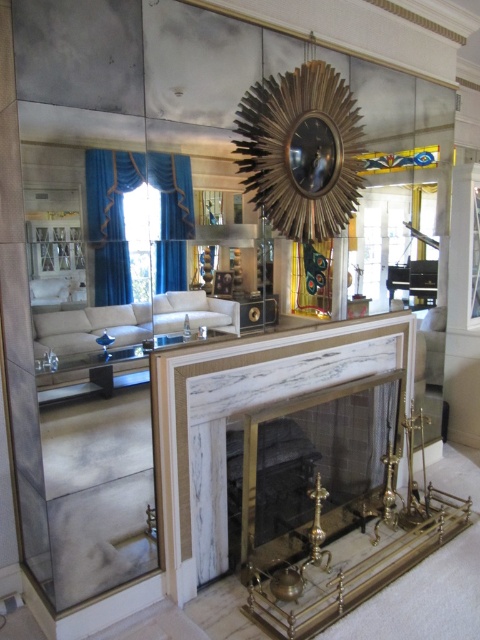
Question: Can you confirm if gold/marble fireplace at center is bigger than gold metallic clock at upper center?

Choices:
 (A) yes
 (B) no

Answer: (A)

Question: Is gold/marble fireplace at center to the right of white marble fireplace at center from the viewer's perspective?

Choices:
 (A) yes
 (B) no

Answer: (A)

Question: Among these objects, which one is farthest from the camera?

Choices:
 (A) white marble fireplace at center
 (B) gold metallic clock at upper center
 (C) gold/marble fireplace at center
 (D) gold textured sunburst clock at center

Answer: (B)

Question: Can you confirm if gold textured sunburst clock at center is positioned above gold metallic clock at upper center?

Choices:
 (A) yes
 (B) no

Answer: (A)

Question: Which object is the closest to the gold textured sunburst clock at center?

Choices:
 (A) gold metallic clock at upper center
 (B) gold/marble fireplace at center
 (C) white leather sofa at center
 (D) white marble fireplace at center

Answer: (A)

Question: Which point appears closest to the camera in this image?

Choices:
 (A) coord(337,156)
 (B) coord(322,154)
 (C) coord(81,385)
 (D) coord(155,304)

Answer: (C)